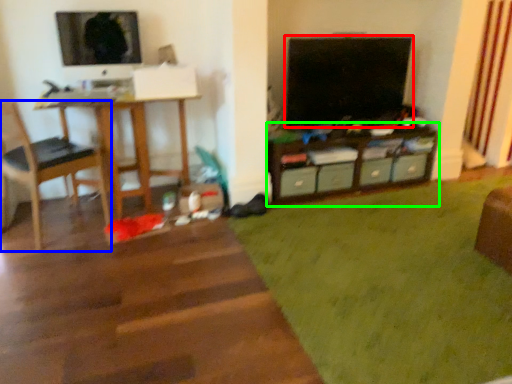
Question: Which object is positioned farthest from television (highlighted by a red box)? Select from chair (highlighted by a blue box) and shelf (highlighted by a green box).

Choices:
 (A) chair
 (B) shelf

Answer: (A)